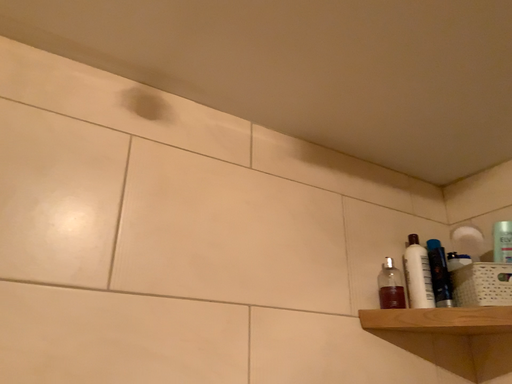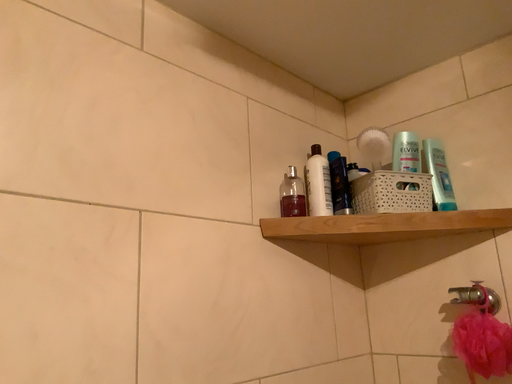
Question: How did the camera likely rotate when shooting the video?

Choices:
 (A) rotated downward
 (B) rotated upward

Answer: (A)